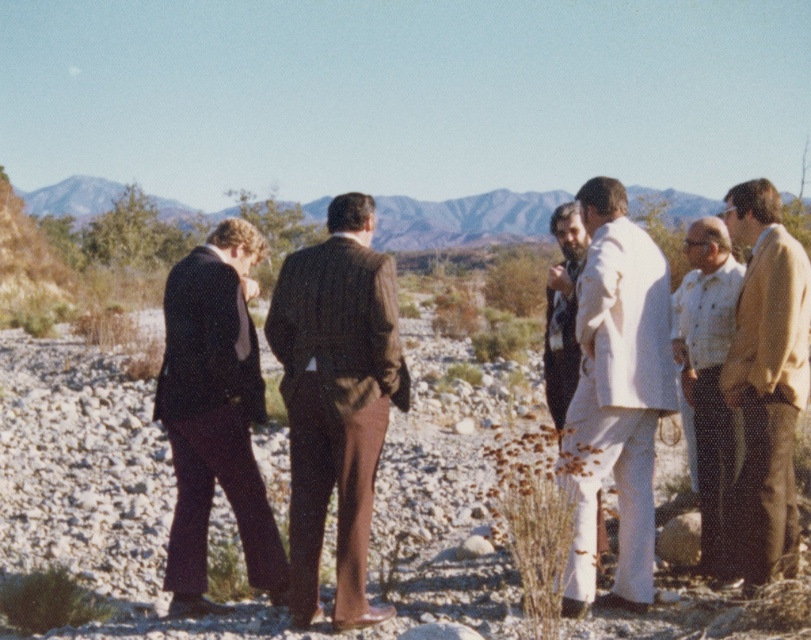
You are a photographer trying to capture a closeup of the brown wool suit at center. According to the coordinates provided, where should you position your camera to get the best shot?

The brown wool suit at center is located at point (337, 400), so position your camera at that coordinate for the best closeup shot.

You are a photographer trying to capture a photo of the dark brown suit at left and the white cotton shirt at right. If you want to ensure both subjects are in focus, which one should you focus on first?

The dark brown suit at left is positioned under the white cotton shirt at right, so you should focus on the dark brown suit at left first to ensure both are in focus.

In the scene shown: You are a photographer trying to capture a group photo of the six men in the desert. You want to ensure that both the brown wool suit at center and the white cotton shirt at right are clearly visible in the frame. Based on their positions, which one should you focus on to ensure both are in focus?

The brown wool suit at center is in front of the white cotton shirt at right. To ensure both are in focus, you should focus on the brown wool suit at center since it is closer to the camera, and the depth of field will likely include the background subject as well.